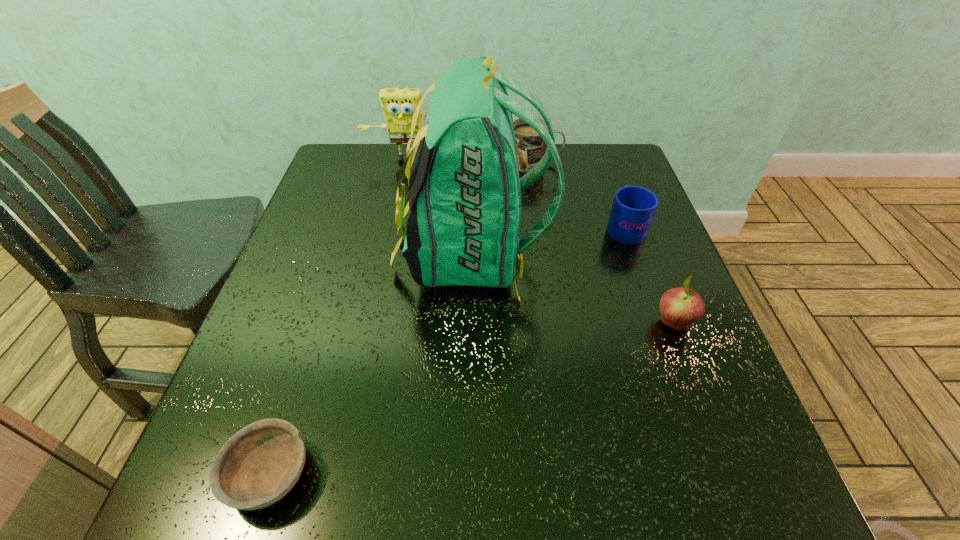
Image resolution: width=960 pixels, height=540 pixels. Find the location of `free spot located 0.150m on the side of the farther mug with the handle`. free spot located 0.150m on the side of the farther mug with the handle is located at coordinates (614, 164).

I want to click on vacant space located on the front of the second nearest object, so click(x=699, y=390).

Image resolution: width=960 pixels, height=540 pixels. Find the location of `vacant space located on the side with the handle of the right mug`. vacant space located on the side with the handle of the right mug is located at coordinates (602, 163).

This screenshot has width=960, height=540. Identify the location of free space located on the side with the handle of the right mug. (597, 149).

Where is `vacant space located on the side with the handle of the right mug`? This screenshot has width=960, height=540. vacant space located on the side with the handle of the right mug is located at coordinates (602, 163).

Find the location of a particular element. free space located on the right of the nearest object is located at coordinates (470, 474).

The width and height of the screenshot is (960, 540). What are the coordinates of `sponge at the far edge` in the screenshot? It's located at (398, 105).

The image size is (960, 540). Identify the location of mug that is at the far edge. (530, 147).

Image resolution: width=960 pixels, height=540 pixels. I want to click on object positioned at the near edge, so click(x=256, y=467).

What are the coordinates of `sponge that is at the left edge` in the screenshot? It's located at (398, 105).